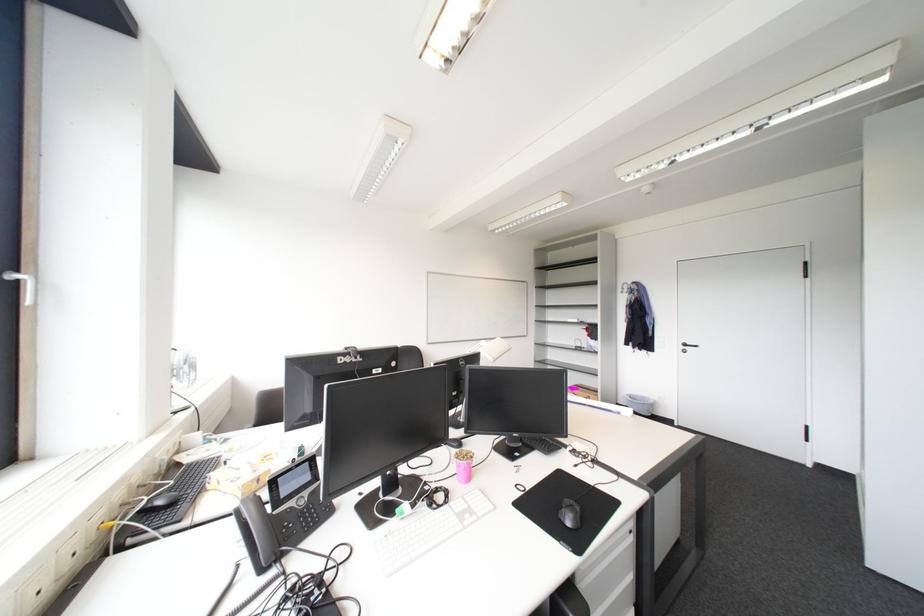
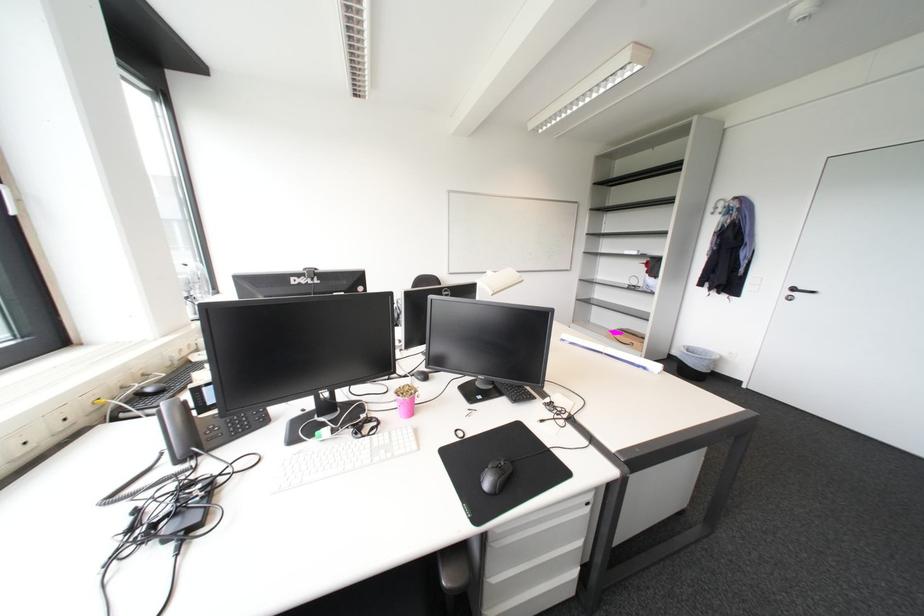
In the second image, find the point that corresponds to [593,569] in the first image.

(508, 532)